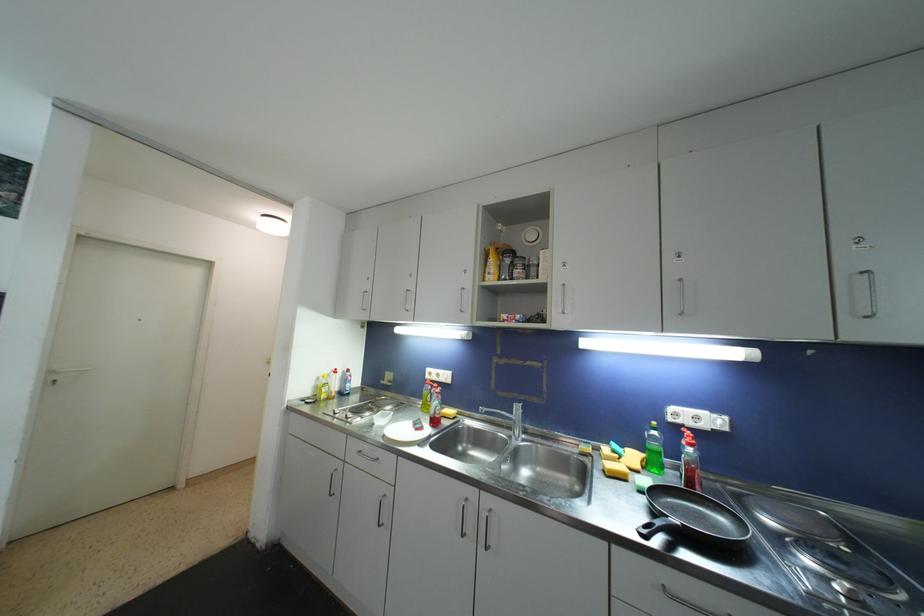
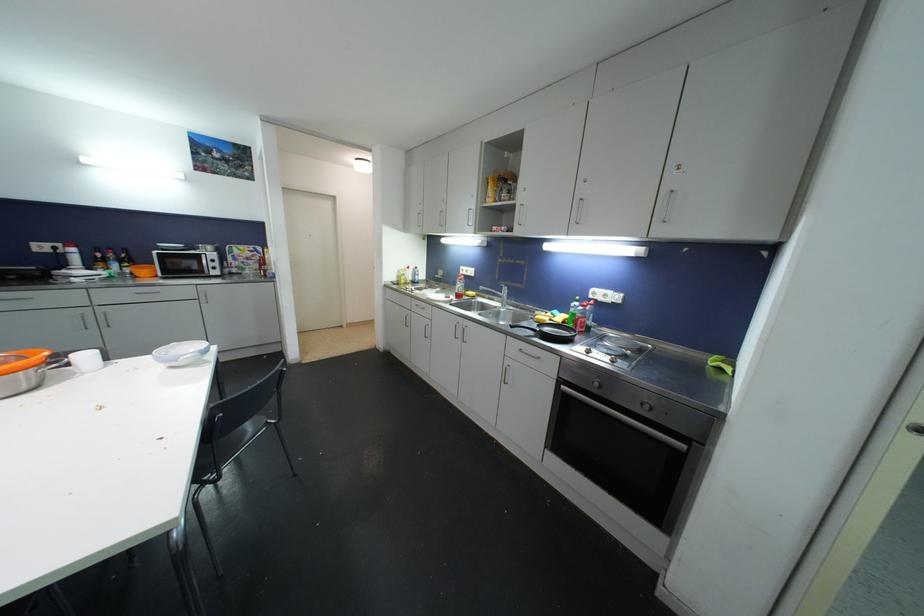
Where in the second image is the point corresponding to point 504,397 from the first image?

(504, 285)